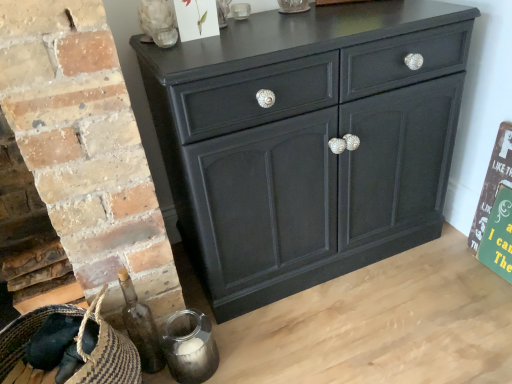
The height and width of the screenshot is (384, 512). In order to click on transparent glass skull at upper left in this screenshot , I will do `click(158, 23)`.

This screenshot has width=512, height=384. Find the location of `rustic wood sign at right`. rustic wood sign at right is located at coordinates (493, 182).

What do you see at coordinates (308, 142) in the screenshot? I see `matte black cabinet at center` at bounding box center [308, 142].

What are the coordinates of `transparent glass skull at upper left` in the screenshot? It's located at (158, 23).

Can you confirm if braided straw basket at lower left is thinner than transparent glass skull at upper left?

No, braided straw basket at lower left is not thinner than transparent glass skull at upper left.

Which is less distant, (x=121, y=360) or (x=167, y=47)?

The point (x=121, y=360) is closer to the camera.

In the scene shown: Between transparent glass skull at upper left and rustic wood sign at right, which one has more height?

rustic wood sign at right is taller.

Is transparent glass skull at upper left completely or partially outside of rustic wood sign at right?

transparent glass skull at upper left is positioned outside rustic wood sign at right.

From the image's perspective, which one is positioned lower, transparent glass skull at upper left or rustic wood sign at right?

rustic wood sign at right, from the image's perspective.

In the image, is transparent glass skull at upper left positioned in front of or behind rustic wood sign at right?

transparent glass skull at upper left is in front of rustic wood sign at right.

Consider the image. Considering the positions of objects rustic wood sign at right and matte black cabinet at center in the image provided, who is in front, rustic wood sign at right or matte black cabinet at center?

matte black cabinet at center.

Locate an element on the screen. bulletin board below the matte black cabinet at center (from a real-world perspective) is located at coordinates (493, 182).

Between rustic wood sign at right and matte black cabinet at center, which one appears on the right side from the viewer's perspective?

rustic wood sign at right is more to the right.

What's the angular difference between rustic wood sign at right and matte black cabinet at center's facing directions?

88.9 degrees.

From the image's perspective, relative to matte black cabinet at center, is braided straw basket at lower left above or below?

Clearly, from the image's perspective, braided straw basket at lower left is below matte black cabinet at center.

Does point (26, 339) appear closer or farther from the camera than point (385, 217)?

Point (26, 339) appears to be closer to the viewer than point (385, 217).

Between braided straw basket at lower left and matte black cabinet at center, which one has less height?

With less height is braided straw basket at lower left.

Which of these two, braided straw basket at lower left or matte black cabinet at center, is smaller?

Smaller between the two is braided straw basket at lower left.

From the image's perspective, between braided straw basket at lower left and rustic wood sign at right, which one is located above?

From the image's view, rustic wood sign at right is above.

Locate an element on the screen. This screenshot has height=384, width=512. bulletin board on the right of braided straw basket at lower left is located at coordinates (493, 182).

Does braided straw basket at lower left turn towards rustic wood sign at right?

No.

How different are the orientations of braided straw basket at lower left and rustic wood sign at right in degrees?

There is a 88.9-degree angle between the facing directions of braided straw basket at lower left and rustic wood sign at right.

How many degrees apart are the facing directions of transparent glass skull at upper left and braided straw basket at lower left?

transparent glass skull at upper left and braided straw basket at lower left are facing 1.68 degrees away from each other.

From a real-world perspective, relative to braided straw basket at lower left, is transparent glass skull at upper left vertically above or below?

transparent glass skull at upper left is situated higher than braided straw basket at lower left in the real world.

At what (x,y) coordinates should I click in order to perform the action: click on basket below the transparent glass skull at upper left (from a real-world perspective). Please return your answer as a coordinate pair (x, y). Image resolution: width=512 pixels, height=384 pixels. Looking at the image, I should click on (66, 348).

Is transparent glass skull at upper left oriented away from braided straw basket at lower left?

No, braided straw basket at lower left is not at the back of transparent glass skull at upper left.

Is point (158, 24) more distant than point (154, 77)?

No, it is not.

Find the location of a particular element. The height and width of the screenshot is (384, 512). chest of drawers below the transparent glass skull at upper left (from a real-world perspective) is located at coordinates (308, 142).

How different are the orientations of transparent glass skull at upper left and matte black cabinet at center in degrees?

1.64 degrees separate the facing orientations of transparent glass skull at upper left and matte black cabinet at center.

Is transparent glass skull at upper left inside or outside of matte black cabinet at center?

transparent glass skull at upper left exists outside the volume of matte black cabinet at center.

This screenshot has height=384, width=512. What are the coordinates of `basket below the transparent glass skull at upper left (from a real-world perspective)` in the screenshot? It's located at (66, 348).

I want to click on glass vase above the rustic wood sign at right (from the image's perspective), so click(x=158, y=23).

Estimate the real-world distances between objects in this image. Which object is further from braided straw basket at lower left, transparent glass skull at upper left or matte black cabinet at center?

transparent glass skull at upper left.

Estimate the real-world distances between objects in this image. Which object is closer to braided straw basket at lower left, matte black cabinet at center or rustic wood sign at right?

matte black cabinet at center.

From the picture: From the image, which object appears to be farther from braided straw basket at lower left, rustic wood sign at right or matte black cabinet at center?

rustic wood sign at right is further to braided straw basket at lower left.

Looking at the image, which one is located closer to braided straw basket at lower left, rustic wood sign at right or transparent glass skull at upper left?

transparent glass skull at upper left.

Based on their spatial positions, is matte black cabinet at center or transparent glass skull at upper left further from rustic wood sign at right?

transparent glass skull at upper left.

Estimate the real-world distances between objects in this image. Which object is further from rustic wood sign at right, transparent glass skull at upper left or braided straw basket at lower left?

Based on the image, braided straw basket at lower left appears to be further to rustic wood sign at right.

Looking at the image, which one is located closer to rustic wood sign at right, transparent glass skull at upper left or matte black cabinet at center?

matte black cabinet at center.

Looking at the image, which one is located closer to matte black cabinet at center, braided straw basket at lower left or rustic wood sign at right?

rustic wood sign at right is positioned closer to the anchor matte black cabinet at center.

Identify the location of the chest of drawers situated between transparent glass skull at upper left and rustic wood sign at right from left to right. (308, 142).

You are a GUI agent. You are given a task and a screenshot of the screen. Output one action in this format:
    pyautogui.click(x=<x>, y=<y>)
    Task: Click on the glass vase situated between braided straw basket at lower left and rustic wood sign at right from left to right
    
    Given the screenshot: What is the action you would take?
    pyautogui.click(x=158, y=23)

Where is `chest of drawers between transparent glass skull at upper left and braided straw basket at lower left in the up-down direction`? chest of drawers between transparent glass skull at upper left and braided straw basket at lower left in the up-down direction is located at coordinates (308, 142).

Where is `chest of drawers between braided straw basket at lower left and rustic wood sign at right in the horizontal direction`? chest of drawers between braided straw basket at lower left and rustic wood sign at right in the horizontal direction is located at coordinates (308, 142).